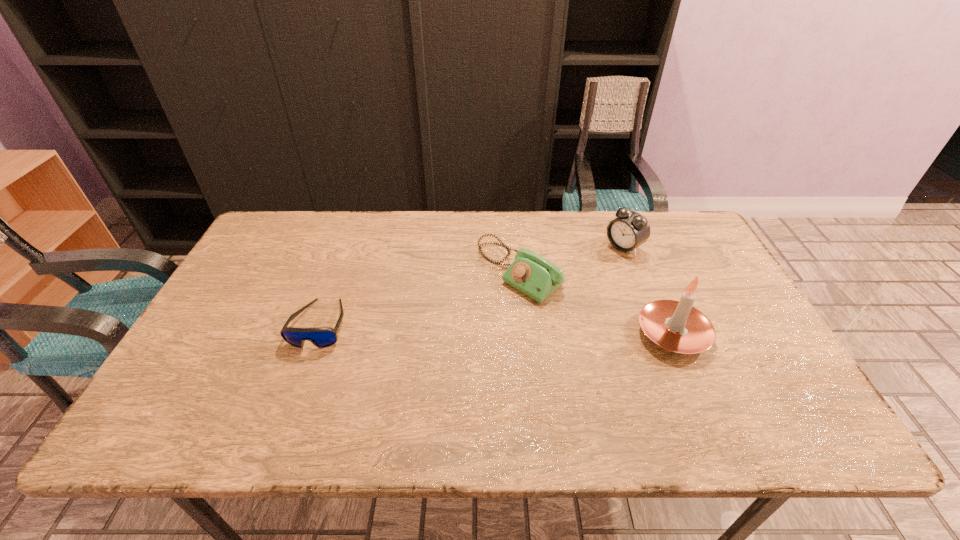
At what (x,y) coordinates should I click in order to perform the action: click on vacant point located between the second object from left to right and the tallest object. Please return your answer as a coordinate pair (x, y). The width and height of the screenshot is (960, 540). Looking at the image, I should click on (596, 303).

Locate an element on the screen. This screenshot has height=540, width=960. free space between the second tallest object and the second object from left to right is located at coordinates (572, 260).

Identify the location of unoccupied position between the telephone and the sunglasses. The width and height of the screenshot is (960, 540). (420, 298).

The width and height of the screenshot is (960, 540). Find the location of `object that is the closest to the second tallest object`. object that is the closest to the second tallest object is located at coordinates (530, 273).

Locate an element on the screen. The width and height of the screenshot is (960, 540). the closest object relative to the candle is located at coordinates (530, 273).